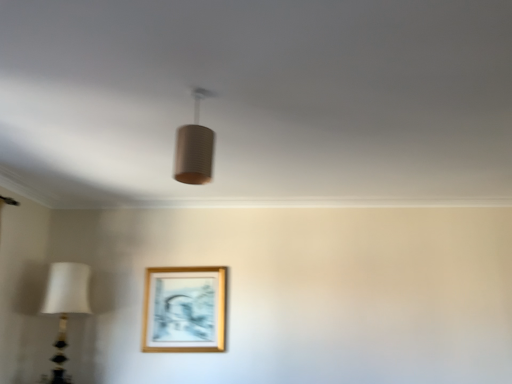
Identify the location of matte brown cylinder at center, the second lamp when ordered from left to right. The image size is (512, 384). (194, 147).

What do you see at coordinates (65, 307) in the screenshot? I see `white fabric lampshade at left, positioned as the first lamp in bottom-to-top order` at bounding box center [65, 307].

Find the location of a particular element. Image resolution: width=512 pixels, height=384 pixels. gold wooden picture frame at lower center is located at coordinates (184, 309).

Considering their positions, is white fabric lampshade at left, which is the 1th lamp in left-to-right order, located in front of or behind gold wooden picture frame at lower center?

white fabric lampshade at left, which is the 1th lamp in left-to-right order, is positioned closer to the viewer than gold wooden picture frame at lower center.

Considering the relative sizes of white fabric lampshade at left, positioned as the first lamp in bottom-to-top order, and gold wooden picture frame at lower center in the image provided, is white fabric lampshade at left, positioned as the first lamp in bottom-to-top order, bigger than gold wooden picture frame at lower center?

Correct, white fabric lampshade at left, positioned as the first lamp in bottom-to-top order, is larger in size than gold wooden picture frame at lower center.

Which is less distant, [61,354] or [179,268]?

The point [61,354] is more forward.

Between point (60, 278) and point (197, 132), which one is positioned behind?

Point (60, 278)

Is white fabric lampshade at left, which is the 1th lamp in left-to-right order, to the right of matte brown cylinder at center, positioned as the first lamp in top-to-bottom order, from the viewer's perspective?

In fact, white fabric lampshade at left, which is the 1th lamp in left-to-right order, is to the left of matte brown cylinder at center, positioned as the first lamp in top-to-bottom order.

Is white fabric lampshade at left, arranged as the 2th lamp when viewed from the front, looking in the opposite direction of matte brown cylinder at center, the second lamp when ordered from left to right?

No, white fabric lampshade at left, arranged as the 2th lamp when viewed from the front, is not facing away from matte brown cylinder at center, the second lamp when ordered from left to right.

This screenshot has width=512, height=384. I want to click on lamp on the right side of white fabric lampshade at left, the second lamp viewed from the top, so click(194, 147).

From a real-world perspective, is gold wooden picture frame at lower center above or below white fabric lampshade at left, arranged as the 2th lamp when viewed from the front?

gold wooden picture frame at lower center is situated higher than white fabric lampshade at left, arranged as the 2th lamp when viewed from the front, in the real world.

Is white fabric lampshade at left, placed as the 2th lamp when sorted from right to left, surrounded by gold wooden picture frame at lower center?

That's incorrect, white fabric lampshade at left, placed as the 2th lamp when sorted from right to left, is not inside gold wooden picture frame at lower center.

Considering the sizes of gold wooden picture frame at lower center and white fabric lampshade at left, which is the 1th lamp in left-to-right order, in the image, is gold wooden picture frame at lower center bigger or smaller than white fabric lampshade at left, which is the 1th lamp in left-to-right order,?

In the image, gold wooden picture frame at lower center appears to be smaller than white fabric lampshade at left, which is the 1th lamp in left-to-right order.

Is gold wooden picture frame at lower center at the right side of white fabric lampshade at left, the second lamp viewed from the top?

Yes.

This screenshot has height=384, width=512. Identify the location of lamp in front of the white fabric lampshade at left, placed as the 2th lamp when sorted from right to left. (194, 147).

Would you consider matte brown cylinder at center, the second lamp when ordered from left to right, to be distant from white fabric lampshade at left, arranged as the 2th lamp when viewed from the front?

matte brown cylinder at center, the second lamp when ordered from left to right, is far away from white fabric lampshade at left, arranged as the 2th lamp when viewed from the front.

Would you say matte brown cylinder at center, the second lamp when ordered from left to right, is outside white fabric lampshade at left, which is the 1th lamp in left-to-right order?

Yes, matte brown cylinder at center, the second lamp when ordered from left to right, is outside of white fabric lampshade at left, which is the 1th lamp in left-to-right order.

From the image's perspective, is matte brown cylinder at center, arranged as the first lamp when viewed from the front, on white fabric lampshade at left, placed as the 2th lamp when sorted from right to left?

Yes, from the image's perspective, matte brown cylinder at center, arranged as the first lamp when viewed from the front, is above white fabric lampshade at left, placed as the 2th lamp when sorted from right to left.

Does point (211, 164) lie in front of point (187, 276)?

Yes, it is.

From the picture: Is matte brown cylinder at center, arranged as the first lamp when viewed from the front, not close to gold wooden picture frame at lower center?

Yes, matte brown cylinder at center, arranged as the first lamp when viewed from the front, and gold wooden picture frame at lower center are quite far apart.

Looking at the image, does matte brown cylinder at center, acting as the 2th lamp starting from the bottom, seem bigger or smaller compared to gold wooden picture frame at lower center?

Clearly, matte brown cylinder at center, acting as the 2th lamp starting from the bottom, is smaller in size than gold wooden picture frame at lower center.

From the image's perspective, would you say matte brown cylinder at center, which is counted as the 1th lamp, starting from the right, is shown under gold wooden picture frame at lower center?

Incorrect, from the image's perspective, matte brown cylinder at center, which is counted as the 1th lamp, starting from the right, is higher than gold wooden picture frame at lower center.

How far apart are gold wooden picture frame at lower center and matte brown cylinder at center, which is counted as the 1th lamp, starting from the right?

gold wooden picture frame at lower center is 6.88 feet away from matte brown cylinder at center, which is counted as the 1th lamp, starting from the right.

Would you say gold wooden picture frame at lower center is outside matte brown cylinder at center, the second lamp when ordered from left to right?

Absolutely, gold wooden picture frame at lower center is external to matte brown cylinder at center, the second lamp when ordered from left to right.

Does gold wooden picture frame at lower center have a lesser width compared to matte brown cylinder at center, arranged as the first lamp when viewed from the front?

Correct, the width of gold wooden picture frame at lower center is less than that of matte brown cylinder at center, arranged as the first lamp when viewed from the front.

Are gold wooden picture frame at lower center and matte brown cylinder at center, arranged as the first lamp when viewed from the front, far apart?

Yes, gold wooden picture frame at lower center and matte brown cylinder at center, arranged as the first lamp when viewed from the front, are quite far apart.

At what (x,y) coordinates should I click in order to perform the action: click on lamp that is the 1st object located in front of the gold wooden picture frame at lower center. Please return your answer as a coordinate pair (x, y). Looking at the image, I should click on (65, 307).

At what (x,y) coordinates should I click in order to perform the action: click on lamp above the white fabric lampshade at left, placed as the 2th lamp when sorted from right to left (from a real-world perspective). Please return your answer as a coordinate pair (x, y). Looking at the image, I should click on (194, 147).

When comparing their distances from matte brown cylinder at center, which is counted as the 1th lamp, starting from the right, does gold wooden picture frame at lower center or white fabric lampshade at left, placed as the 2th lamp when sorted from right to left, seem closer?

gold wooden picture frame at lower center is positioned closer to the anchor matte brown cylinder at center, which is counted as the 1th lamp, starting from the right.

Which object lies nearer to the anchor point white fabric lampshade at left, placed as the 2th lamp when sorted from right to left, matte brown cylinder at center, positioned as the first lamp in top-to-bottom order, or gold wooden picture frame at lower center?

gold wooden picture frame at lower center lies closer to white fabric lampshade at left, placed as the 2th lamp when sorted from right to left, than the other object.

Considering their positions, is gold wooden picture frame at lower center positioned further to white fabric lampshade at left, arranged as the 2th lamp when viewed from the front, than matte brown cylinder at center, acting as the 2th lamp starting from the bottom?

matte brown cylinder at center, acting as the 2th lamp starting from the bottom, is positioned further to the anchor white fabric lampshade at left, arranged as the 2th lamp when viewed from the front.

Estimate the real-world distances between objects in this image. Which object is closer to gold wooden picture frame at lower center, matte brown cylinder at center, which is counted as the 1th lamp, starting from the right, or white fabric lampshade at left, positioned as the first lamp in bottom-to-top order?

Based on the image, white fabric lampshade at left, positioned as the first lamp in bottom-to-top order, appears to be nearer to gold wooden picture frame at lower center.

Which object lies nearer to the anchor point gold wooden picture frame at lower center, white fabric lampshade at left, placed as the 2th lamp when sorted from right to left, or matte brown cylinder at center, positioned as the first lamp in top-to-bottom order?

The object closer to gold wooden picture frame at lower center is white fabric lampshade at left, placed as the 2th lamp when sorted from right to left.

Looking at the image, which one is located further to matte brown cylinder at center, which appears as the second lamp when viewed from the back, white fabric lampshade at left, arranged as the 2th lamp when viewed from the front, or gold wooden picture frame at lower center?

white fabric lampshade at left, arranged as the 2th lamp when viewed from the front, lies further to matte brown cylinder at center, which appears as the second lamp when viewed from the back, than the other object.

At what (x,y) coordinates should I click in order to perform the action: click on lamp between matte brown cylinder at center, the second lamp when ordered from left to right, and gold wooden picture frame at lower center in the front-back direction. Please return your answer as a coordinate pair (x, y). The image size is (512, 384). Looking at the image, I should click on (65, 307).